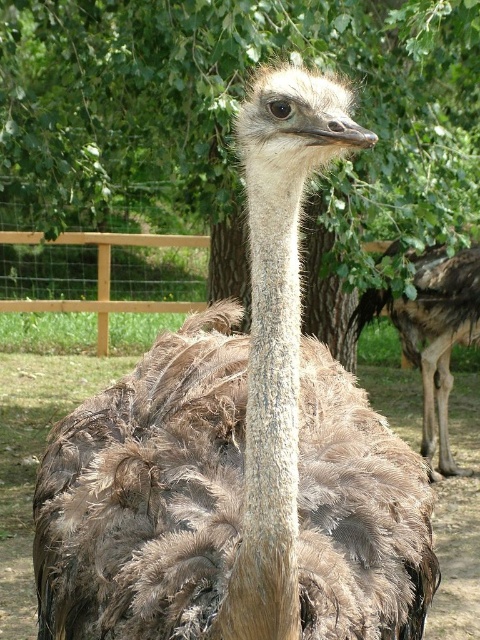
Does green leafy tree at center have a lesser height compared to brown feathered ostrich at center?

No.

Who is more forward, (x=4, y=81) or (x=432, y=307)?

Point (x=4, y=81) is more forward.

At what (x,y) coordinates should I click in order to perform the action: click on green leafy tree at center. Please return your answer as a coordinate pair (x, y). This screenshot has width=480, height=640. Looking at the image, I should click on (230, 124).